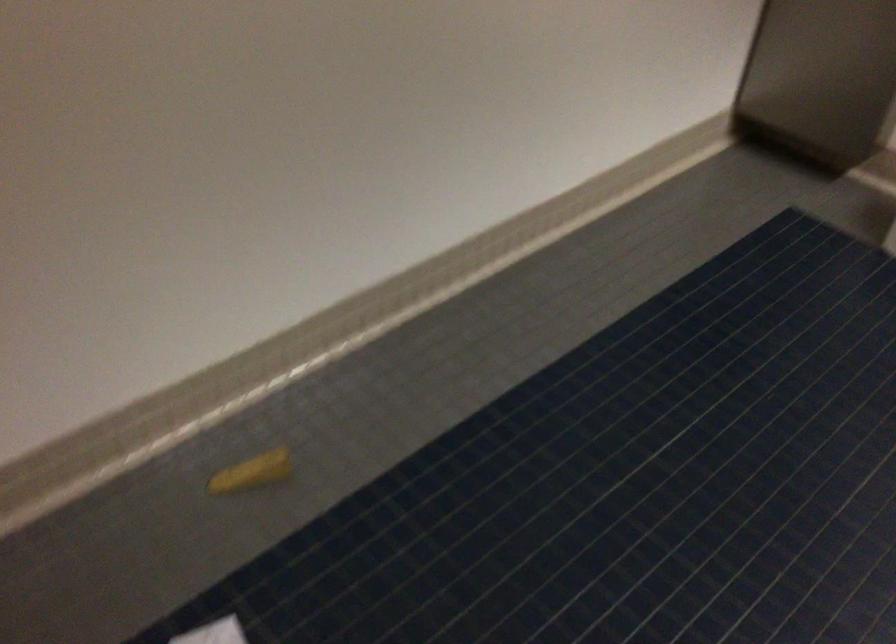
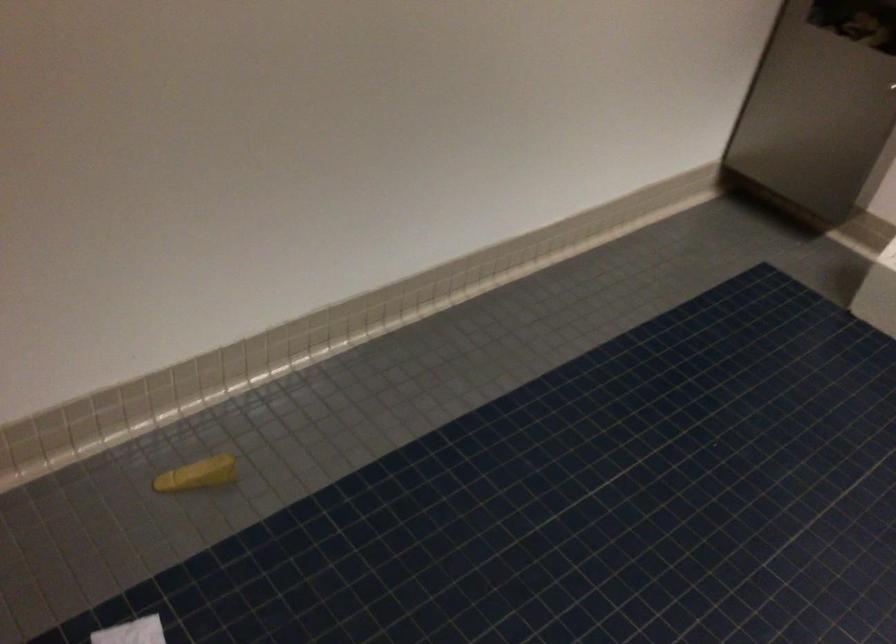
The point at (252, 474) is marked in the first image. Where is the corresponding point in the second image?

(197, 474)